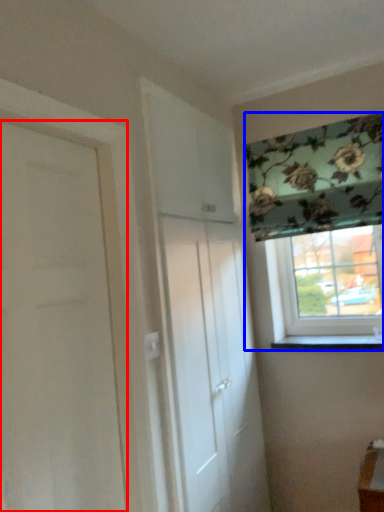
Question: Which object appears closest to the camera in this image, door (highlighted by a red box) or window (highlighted by a blue box)?

Choices:
 (A) door
 (B) window

Answer: (A)